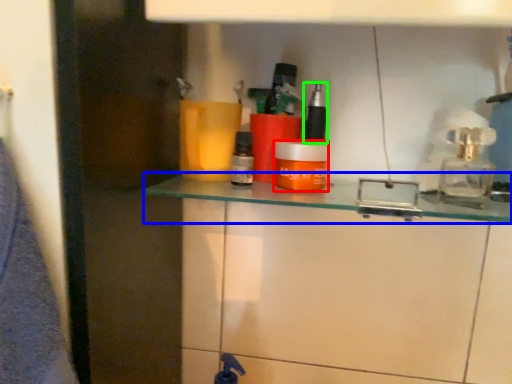
Question: Based on their relative distances, which object is nearer to mouthwash (highlighted by a red box)? Choose from shelf (highlighted by a blue box) and toiletry (highlighted by a green box).

Choices:
 (A) shelf
 (B) toiletry

Answer: (A)